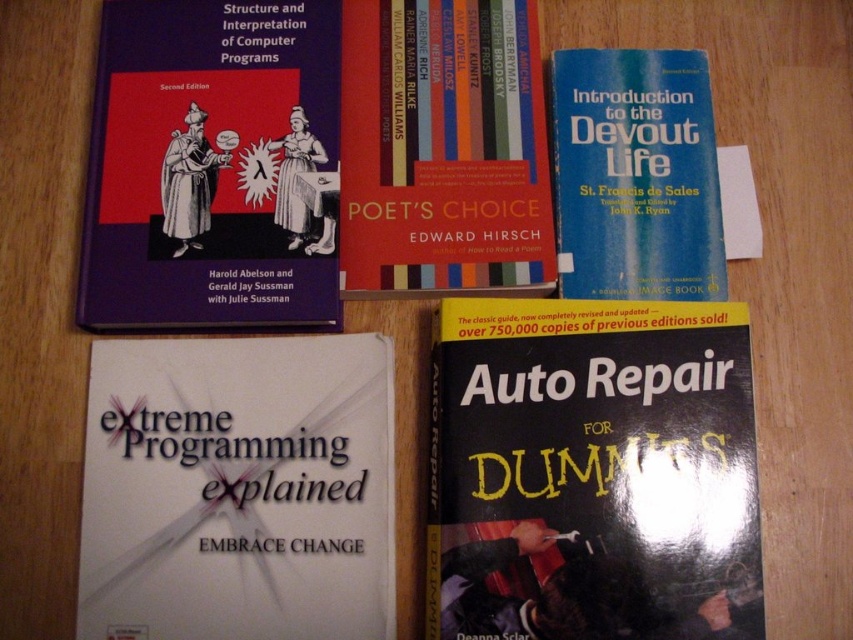
In the scene shown: Who is shorter, white paper at lower left or matte hardcover book at upper left?

white paper at lower left is shorter.

Is point (184, 424) positioned before point (112, 132)?

Yes, it is.

Identify the location of white paper at lower left. (238, 490).

Which is more to the left, black glossy book at lower right or matte hardcover book at upper left?

From the viewer's perspective, matte hardcover book at upper left appears more on the left side.

Is black glossy book at lower right to the left of matte hardcover book at upper left from the viewer's perspective?

In fact, black glossy book at lower right is to the right of matte hardcover book at upper left.

Who is more distant from viewer, (x=450, y=433) or (x=292, y=259)?

Point (x=292, y=259)

This screenshot has width=853, height=640. What are the coordinates of `black glossy book at lower right` in the screenshot? It's located at (592, 472).

Does matte hardcover book at upper left have a larger size compared to red matte book at upper center?

Yes, matte hardcover book at upper left is bigger than red matte book at upper center.

This screenshot has width=853, height=640. Identify the location of matte hardcover book at upper left. (210, 164).